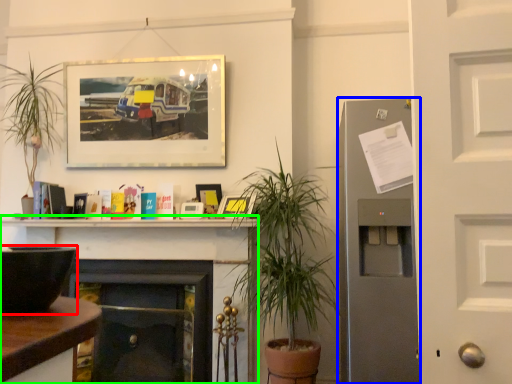
Question: Which object is the farthest from appliance (highlighted by a red box)? Choose among these: fireplace (highlighted by a blue box) or fireplace (highlighted by a green box).

Choices:
 (A) fireplace
 (B) fireplace

Answer: (B)